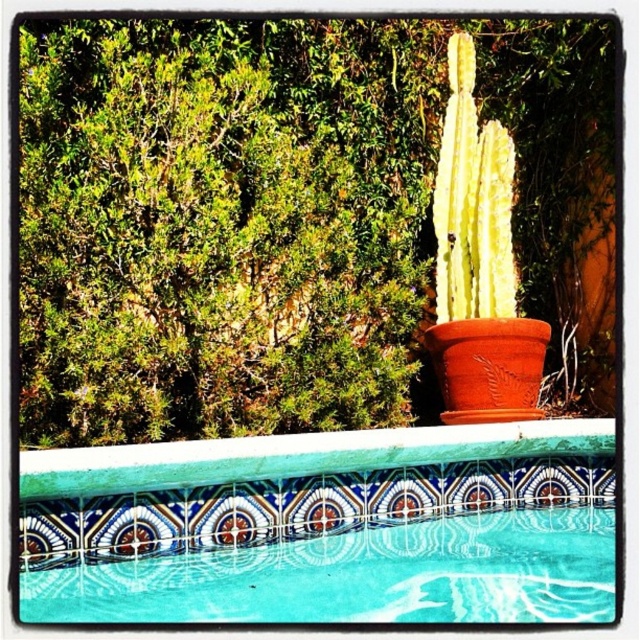
Who is higher up, yellow-green spiky cactus at center-right or blue mosaic tile at upper center?

yellow-green spiky cactus at center-right

Can you confirm if yellow-green spiky cactus at center-right is shorter than blue mosaic tile at upper center?

No.

Describe the element at coordinates (284, 218) in the screenshot. The image size is (640, 640). I see `yellow-green spiky cactus at center-right` at that location.

At what (x,y) coordinates should I click in order to perform the action: click on yellow-green spiky cactus at center-right. Please return your answer as a coordinate pair (x, y). Looking at the image, I should click on (284, 218).